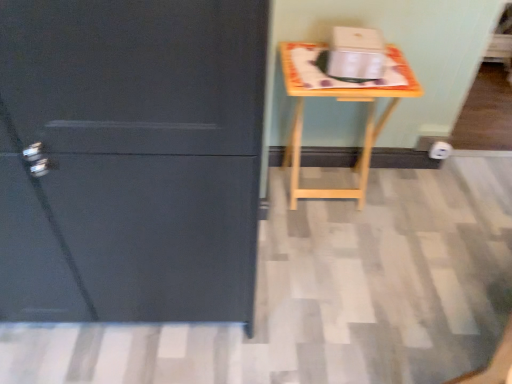
Describe the element at coordinates (345, 101) in the screenshot. I see `wooden table at right` at that location.

The image size is (512, 384). I want to click on wooden table at right, so click(x=345, y=101).

Locate an element on the screen. The height and width of the screenshot is (384, 512). wooden table at right is located at coordinates (345, 101).